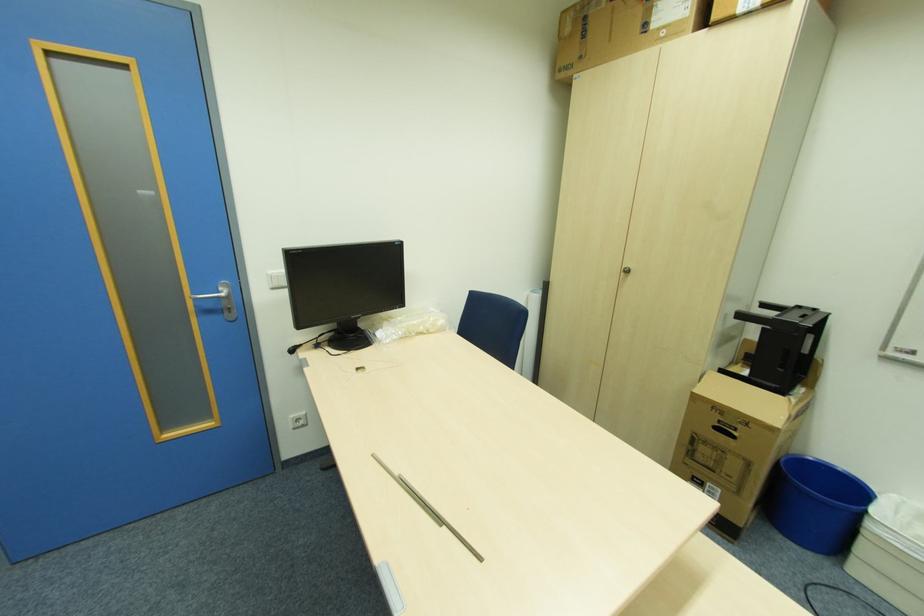
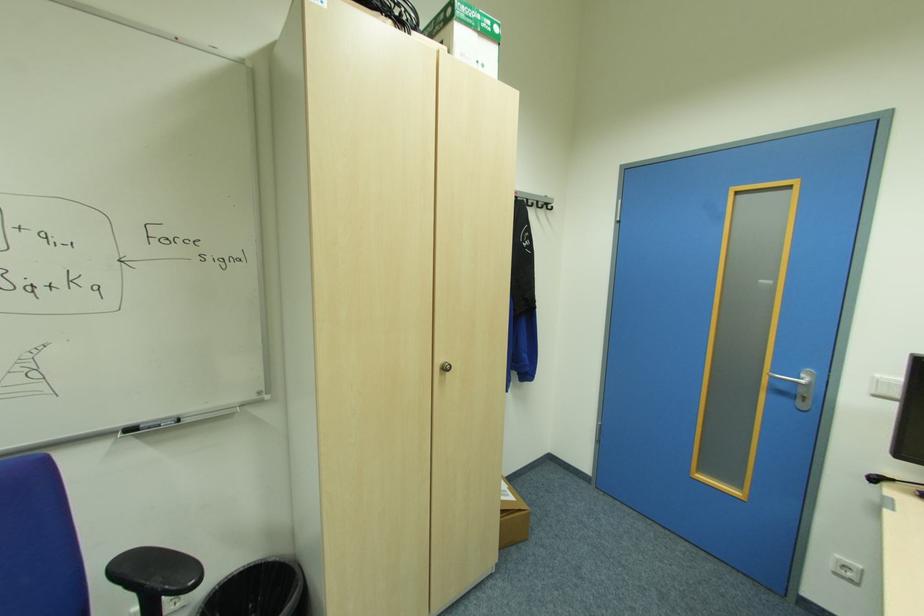
Question: The camera is either moving clockwise (left) or counter-clockwise (right) around the object. The first image is from the beginning of the video and the second image is from the end. Is the camera moving left or right when shooting the video?

Choices:
 (A) Left
 (B) Right

Answer: (B)